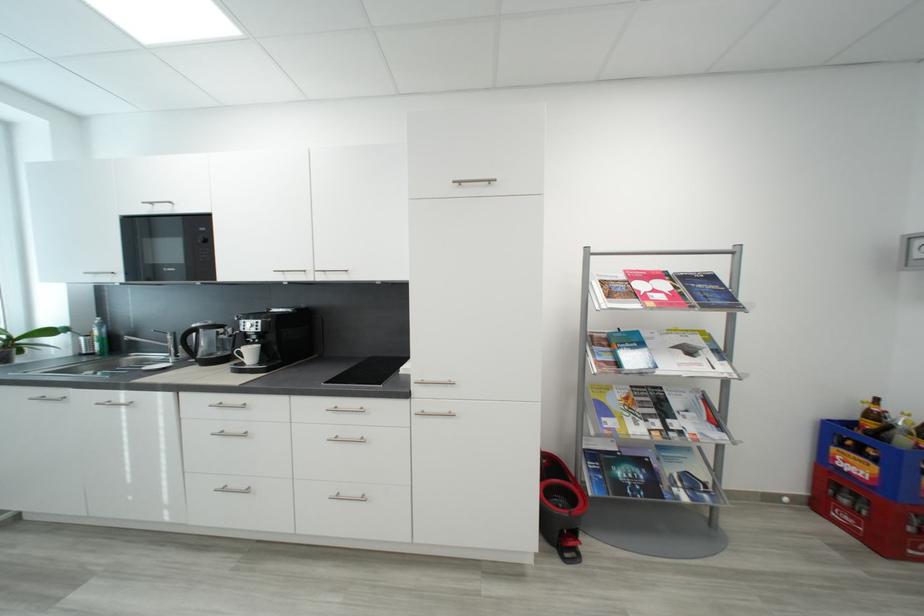
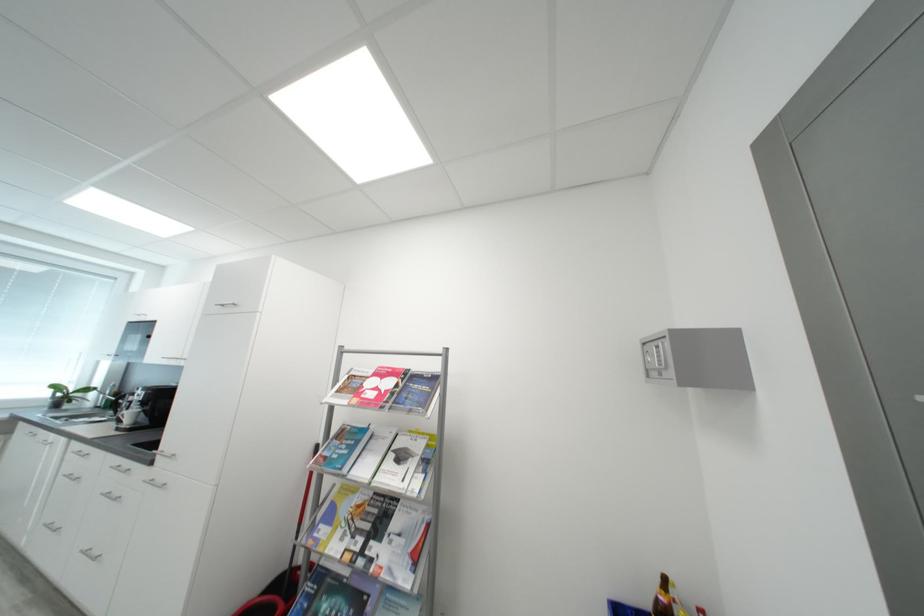
Find the pixel in the second image that matches (84,336) in the first image.

(108, 394)